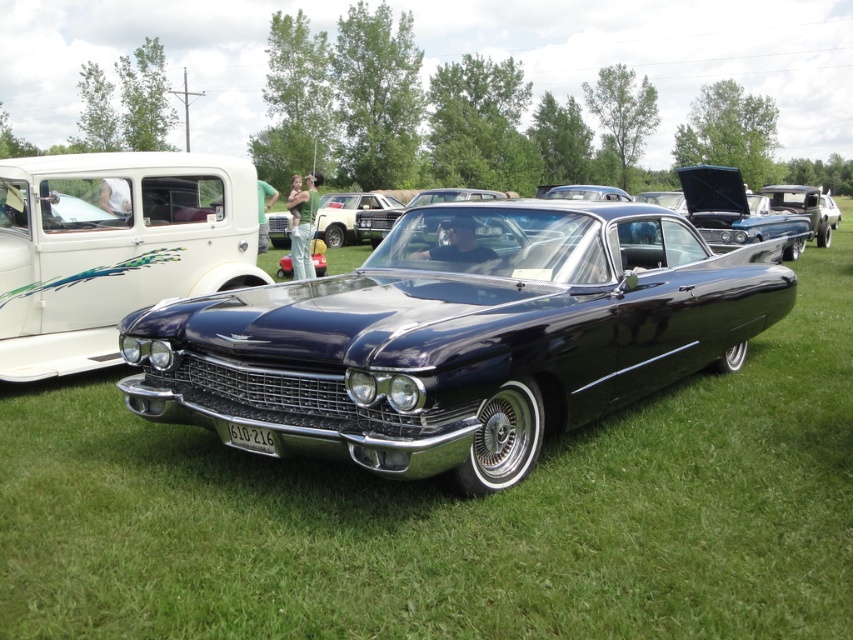
Is shiny dark blue car at center positioned at the back of white glossy pickup truck at upper left?

No.

What do you see at coordinates (457, 339) in the screenshot? This screenshot has height=640, width=853. I see `shiny dark blue car at center` at bounding box center [457, 339].

This screenshot has height=640, width=853. Identify the location of shiny dark blue car at center. (457, 339).